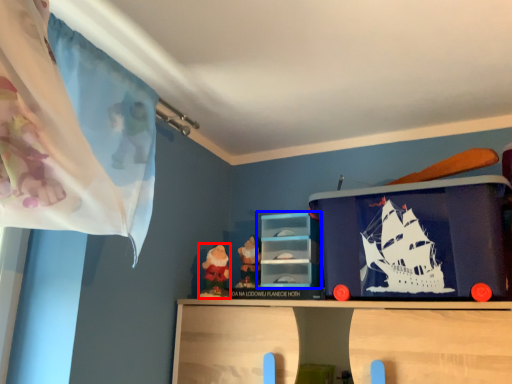
Question: Which object appears closest to the camera in this image, toy (highlighted by a red box) or shelf (highlighted by a blue box)?

Choices:
 (A) toy
 (B) shelf

Answer: (B)